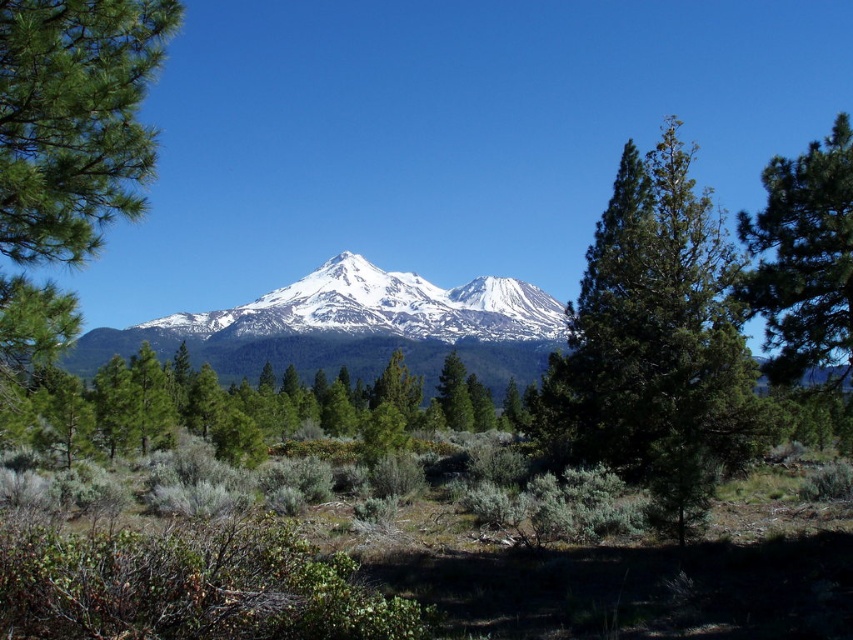
You are an environmental scientist studying the layers of vegetation in the landscape. You observe the green textured tree at center and the green matte tree at center. Which tree is located higher up in the scene?

The green textured tree at center is positioned over the green matte tree at center, so it is higher up in the scene.

You are an environmental scientist studying the vegetation in this landscape. You observe the green textured tree at center and the green textured pine tree at right. Which tree is located more to the left in the image?

The green textured pine tree at right is more to the left than the green textured tree at center because the green textured tree at center is positioned on the right side of the green textured pine tree at right.